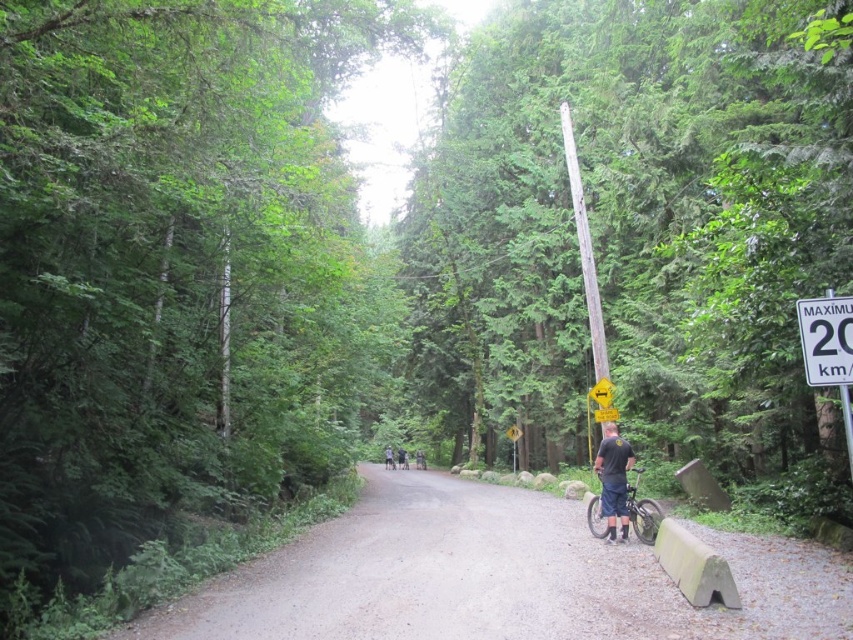
Question: Among these points, which one is farthest from the camera?

Choices:
 (A) (599, 320)
 (B) (541, 513)

Answer: (A)

Question: Which point is farther to the camera?

Choices:
 (A) dark gray t-shirt at center
 (B) dirt road at center

Answer: (A)

Question: Which point is closer to the camera taking this photo?

Choices:
 (A) (607, 454)
 (B) (415, 465)

Answer: (A)

Question: Is shiny metallic bicycle at lower right to the right of light blue jeans at center from the viewer's perspective?

Choices:
 (A) yes
 (B) no

Answer: (A)

Question: Does dirt road at center lie in front of dark gray t-shirt at center?

Choices:
 (A) yes
 (B) no

Answer: (A)

Question: Is dirt road at center further to camera compared to light blue jeans at center?

Choices:
 (A) no
 (B) yes

Answer: (A)